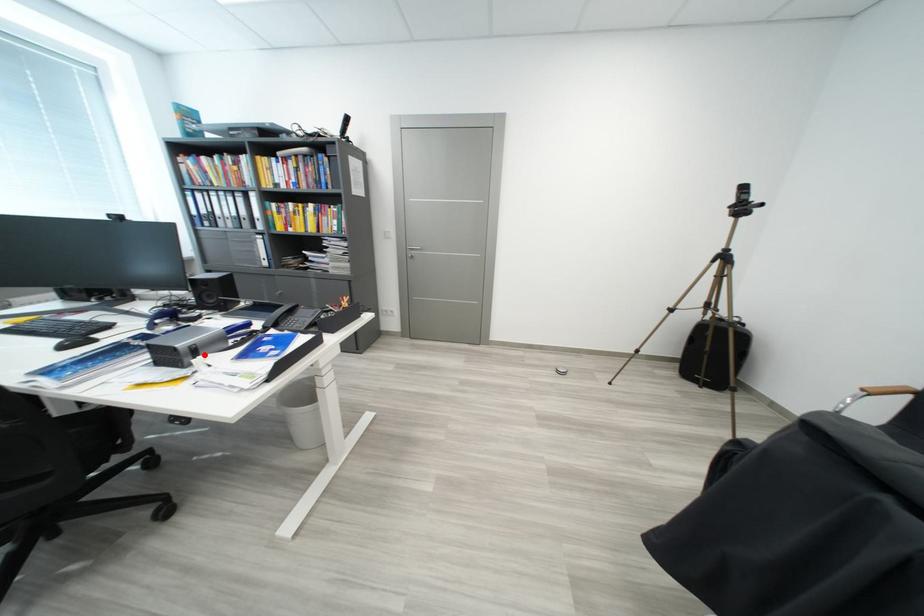
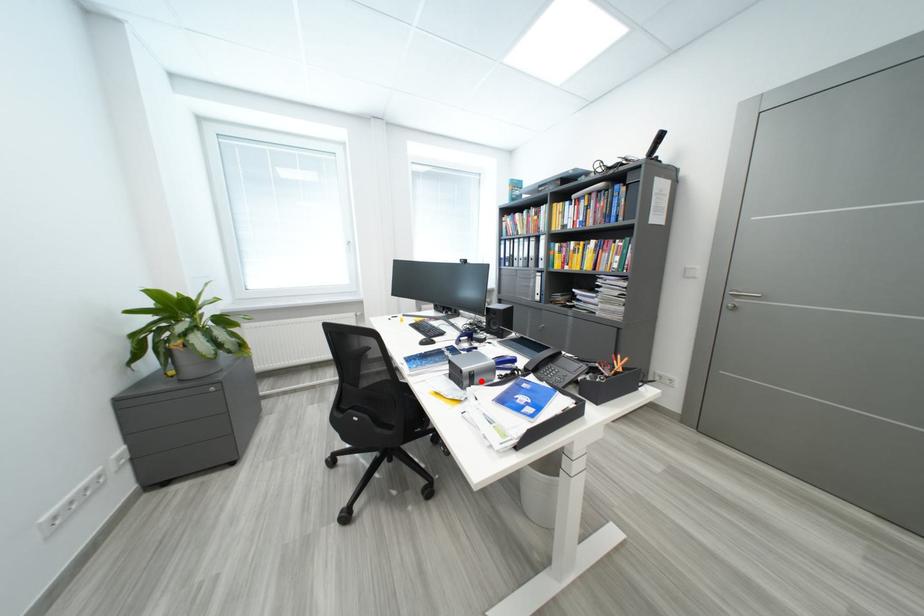
I am providing you with two images of the same scene from different viewpoints. A red point is marked on the first image and another point is marked on the second image. Does the point marked in image1 correspond to the same location as the one in image2?

Yes